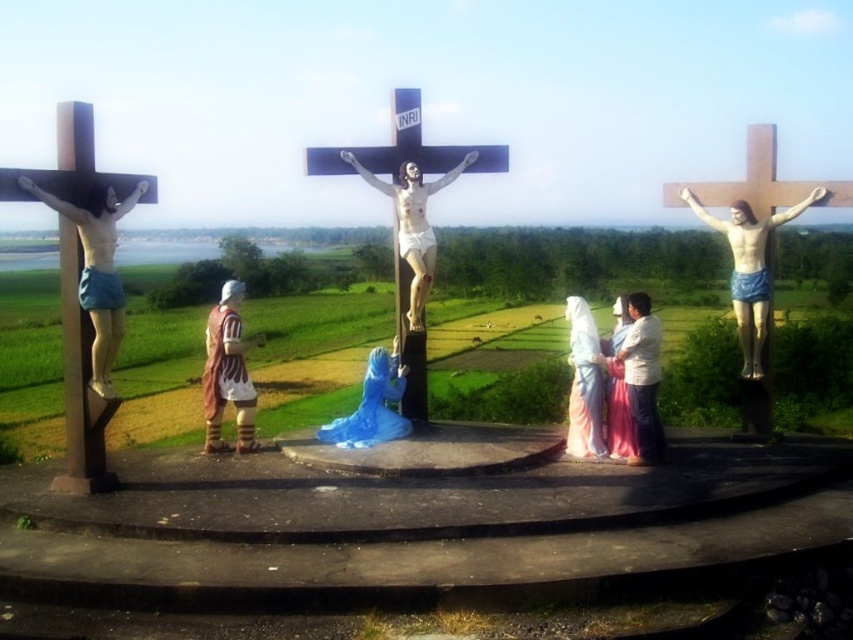
Is polished wood cross at center above brown leather armor at center left?

Indeed, polished wood cross at center is positioned over brown leather armor at center left.

Who is taller, polished wood cross at center or brown leather armor at center left?

Standing taller between the two is brown leather armor at center left.

Is point (494, 157) farther from viewer compared to point (218, 332)?

Yes, it is.

Where is `polished wood cross at center`? This screenshot has height=640, width=853. polished wood cross at center is located at coordinates (405, 148).

Who is positioned more to the left, brown wooden cross at left or wooden statue of jesus at right?

From the viewer's perspective, brown wooden cross at left appears more on the left side.

Measure the distance between brown wooden cross at left and camera.

brown wooden cross at left and camera are 5.46 meters apart from each other.

Where is `brown wooden cross at left`? Image resolution: width=853 pixels, height=640 pixels. brown wooden cross at left is located at coordinates (79, 381).

Consider the image. Is matte blue shorts at left shorter than white matte crucifix at center?

No, matte blue shorts at left is not shorter than white matte crucifix at center.

Is matte blue shorts at left to the left of white matte crucifix at center from the viewer's perspective?

Correct, you'll find matte blue shorts at left to the left of white matte crucifix at center.

Does point (97, 355) come behind point (418, 244)?

No, it is in front of (418, 244).

Find the location of `matte blue shorts at left`. matte blue shorts at left is located at coordinates (97, 269).